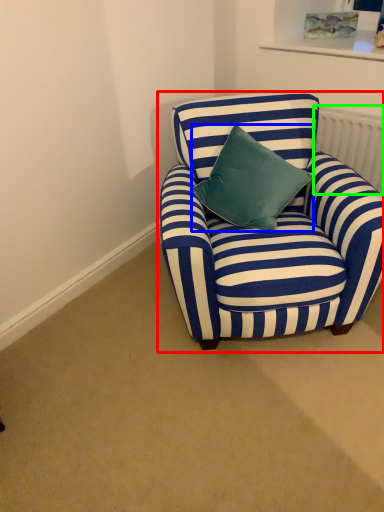
Question: Which object is positioned farthest from chair (highlighted by a red box)? Select from pillow (highlighted by a blue box) and radiator (highlighted by a green box).

Choices:
 (A) pillow
 (B) radiator

Answer: (B)